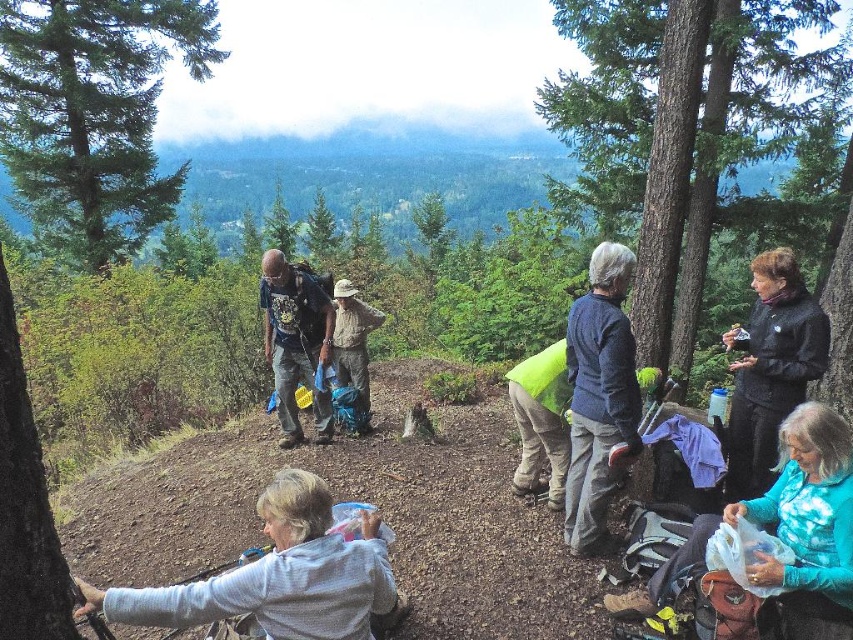
You are a photographer at the scenic overlook. You want to take a photo that includes both the green matte tree trunk at left and the camouflage fabric jacket at center. Which object should you frame closer to the edge of the photo to ensure both are visible?

The green matte tree trunk at left has a smaller size compared to camouflage fabric jacket at center, so you should frame the green matte tree trunk at left closer to the edge of the photo to ensure both are visible.

You are a photographer trying to capture a photo of the camouflage fabric jacket at center while including the green matte tree trunk at left in the frame. Based on their positions, can you position yourself so that both objects are visible in the same shot?

Yes, since the green matte tree trunk at left is positioned on the left side of the camouflage fabric jacket at center, you can position yourself to the right of the camouflage fabric jacket at center to include both in the frame.